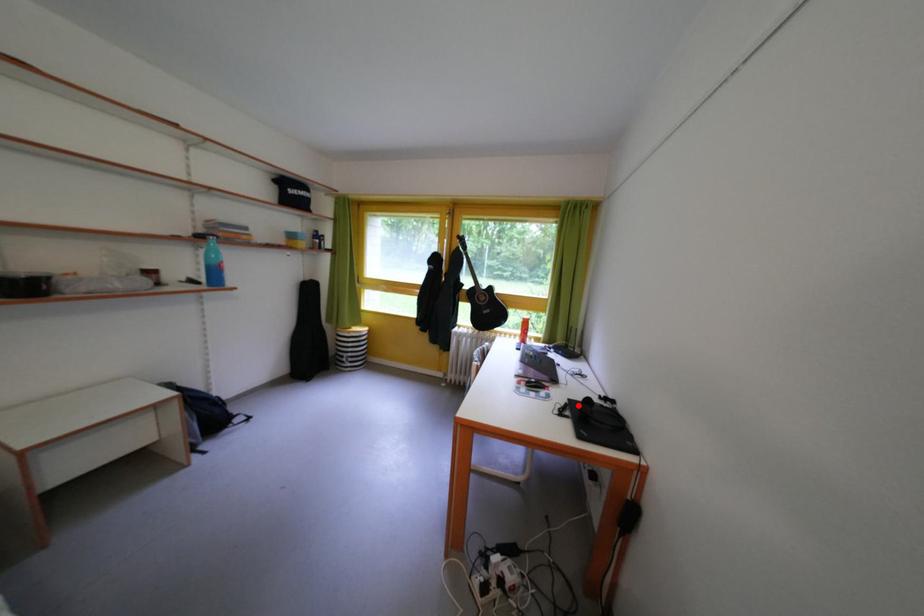
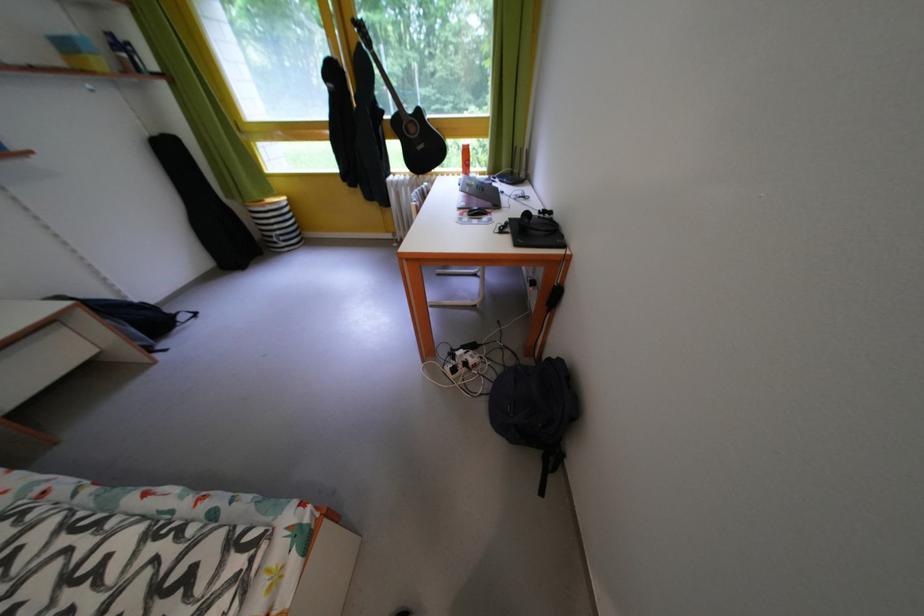
Where in the second image is the point corresponding to the highlighted location from the first image?

(519, 225)